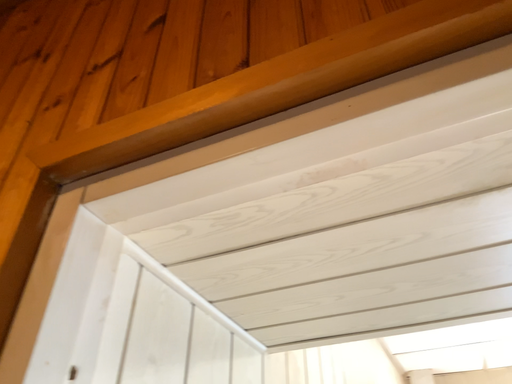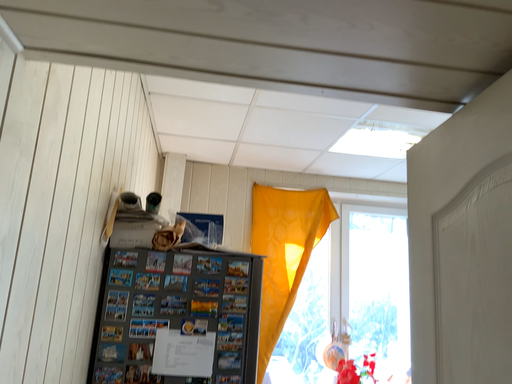
Question: Which way did the camera rotate in the video?

Choices:
 (A) rotated right
 (B) rotated left

Answer: (A)